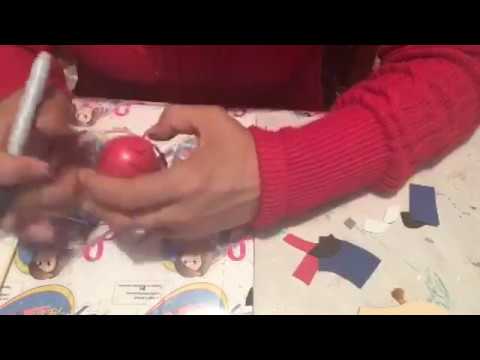
At what (x,y) coordinates should I click in order to perform the action: click on table. Please return your answer as a coordinate pair (x, y). This screenshot has width=480, height=360. Looking at the image, I should click on (267, 266).